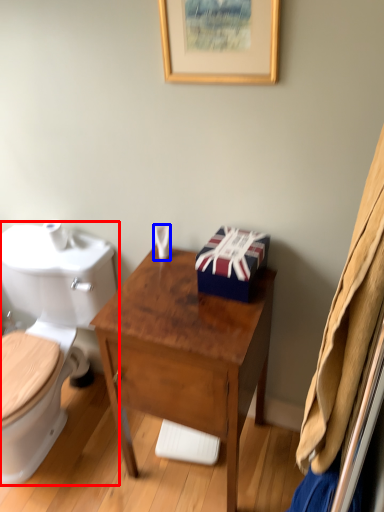
Question: Among these objects, which one is nearest to the camera, toilet (highlighted by a red box) or toiletries (highlighted by a blue box)?

Choices:
 (A) toilet
 (B) toiletries

Answer: (A)